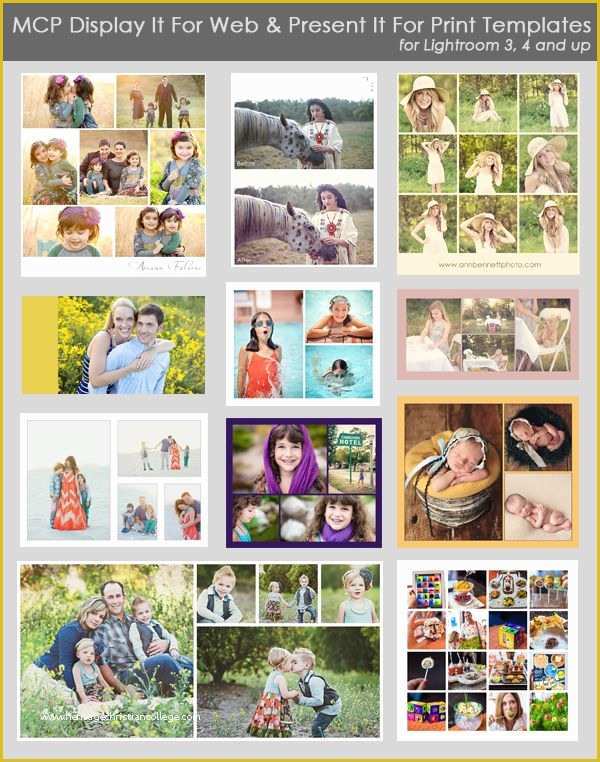
Find the location of `photographs in a 3x3 grid collage`. photographs in a 3x3 grid collage is located at coordinates (430, 107), (499, 103), (550, 103), (557, 155), (487, 164), (435, 168), (435, 221), (486, 223), (543, 231).